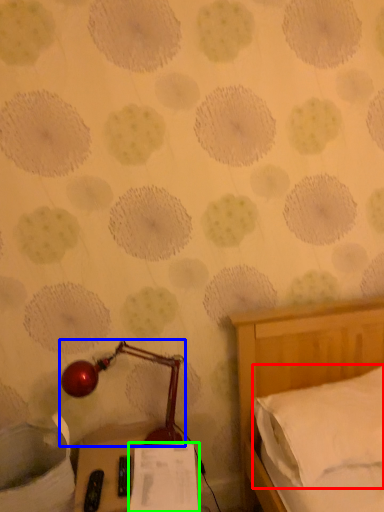
Question: Which is nearer to the pillow (highlighted by a red box)? lamp (highlighted by a blue box) or paper (highlighted by a green box).

Choices:
 (A) lamp
 (B) paper

Answer: (B)